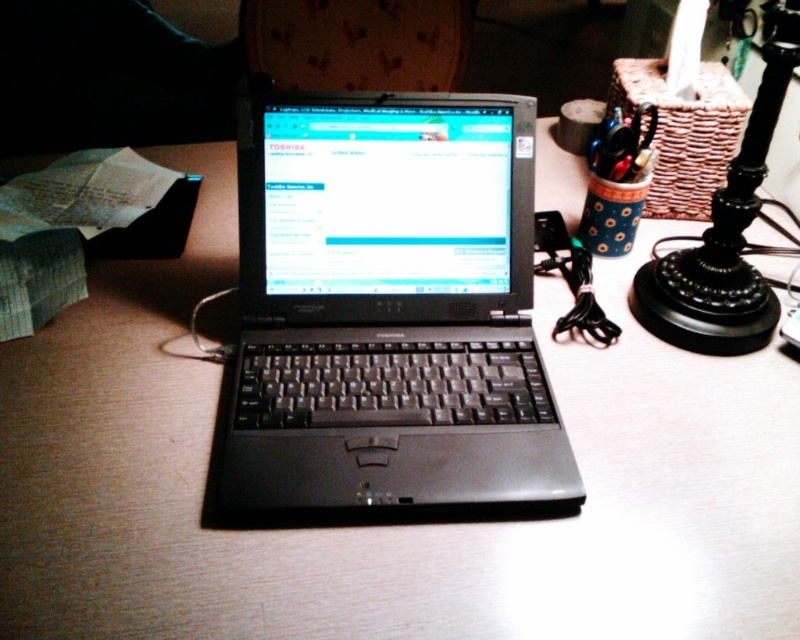
Question: Is the position of black plastic laptop at center less distant than that of black metal lamp at upper right?

Choices:
 (A) no
 (B) yes

Answer: (B)

Question: Does black plastic laptop at center have a larger size compared to black metal lamp at upper right?

Choices:
 (A) no
 (B) yes

Answer: (A)

Question: Can you confirm if black plastic laptop at center is smaller than black metal lamp at upper right?

Choices:
 (A) yes
 (B) no

Answer: (A)

Question: Which point appears closest to the camera in this image?

Choices:
 (A) (740, 248)
 (B) (442, 248)

Answer: (B)